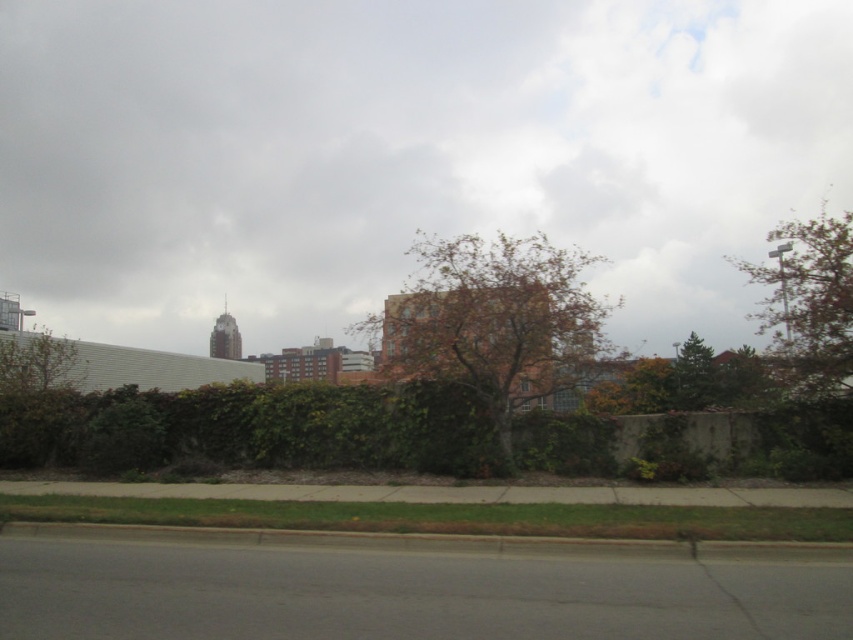
Can you confirm if brown textured tree at center is positioned below green leafy tree at left?

Actually, brown textured tree at center is above green leafy tree at left.

Can you confirm if brown textured tree at center is wider than green leafy tree at left?

Correct, the width of brown textured tree at center exceeds that of green leafy tree at left.

What do you see at coordinates (495, 321) in the screenshot? I see `brown textured tree at center` at bounding box center [495, 321].

Find the location of a particular element. brown textured tree at center is located at coordinates (495, 321).

Does brown textured tree at center have a lesser height compared to brown textured tree at upper right?

Indeed, brown textured tree at center has a lesser height compared to brown textured tree at upper right.

Which is in front, point (506, 406) or point (839, 284)?

Point (839, 284) is in front.

At what (x,y) coordinates should I click in order to perform the action: click on brown textured tree at center. Please return your answer as a coordinate pair (x, y). Looking at the image, I should click on (495, 321).

Can you confirm if green leafy hedge at lower center is positioned to the left of brown textured tree at center?

Yes, green leafy hedge at lower center is to the left of brown textured tree at center.

Is point (306, 445) positioned behind point (572, 369)?

Yes, point (306, 445) is behind point (572, 369).

This screenshot has height=640, width=853. Describe the element at coordinates (254, 429) in the screenshot. I see `green leafy hedge at lower center` at that location.

Where is `green leafy hedge at lower center`? The image size is (853, 640). green leafy hedge at lower center is located at coordinates (254, 429).